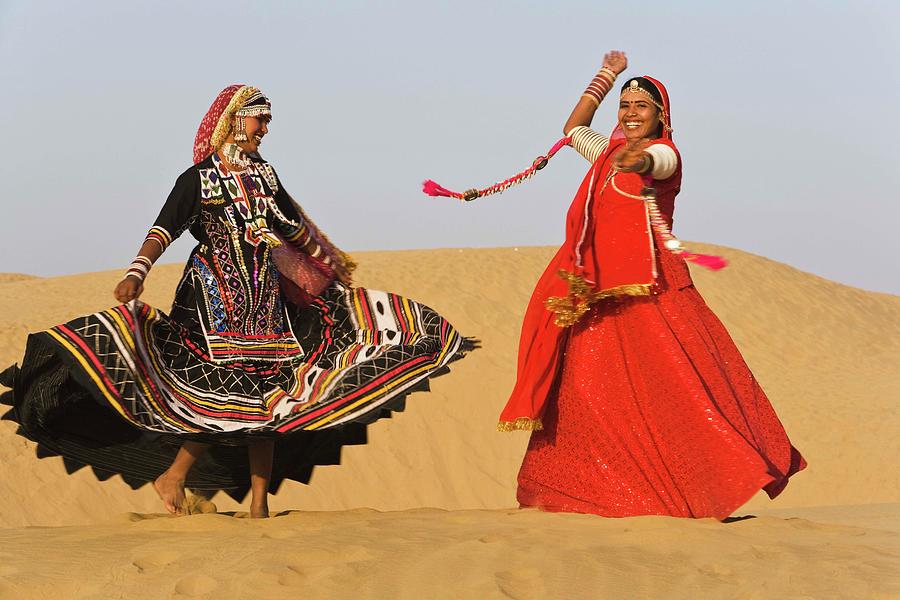
At what (x,y) coordinates should I click in order to perform the action: click on tassels. Please return your answer as a coordinate pair (x, y). Looking at the image, I should click on (433, 186).